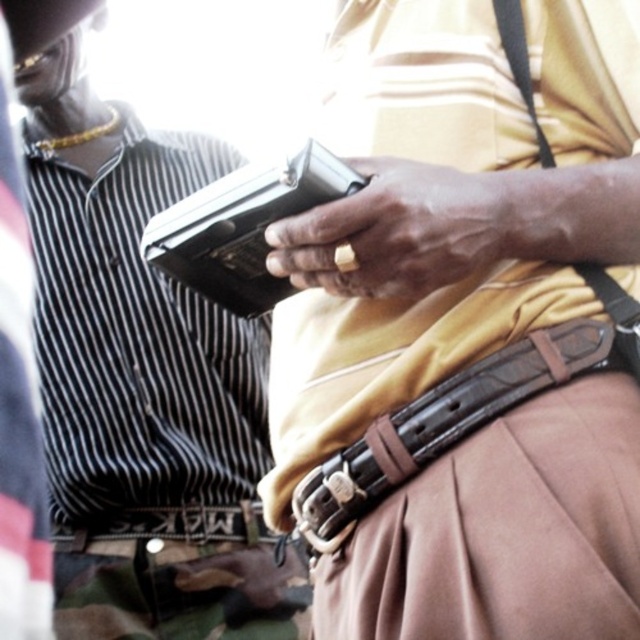
You are a security officer who needs to quickly access either the matte black wallet at left or the metallic gun at center during a routine check. Which item is closer to you and can be reached faster?

The matte black wallet at left is closer to you than the metallic gun at center, so it can be reached faster.

You are a security officer in the scene and need to locate the matte black wallet at left. According to the coordinates provided, where should you look to find it?

The matte black wallet at left is located at the 2D coordinates point (x=141, y=384).

You are a security guard checking the equipment in the scene. You see the metallic gun at center and the brown leather belt at lower center. Which object is bigger in size?

The metallic gun at center is larger in size than the brown leather belt at lower center.